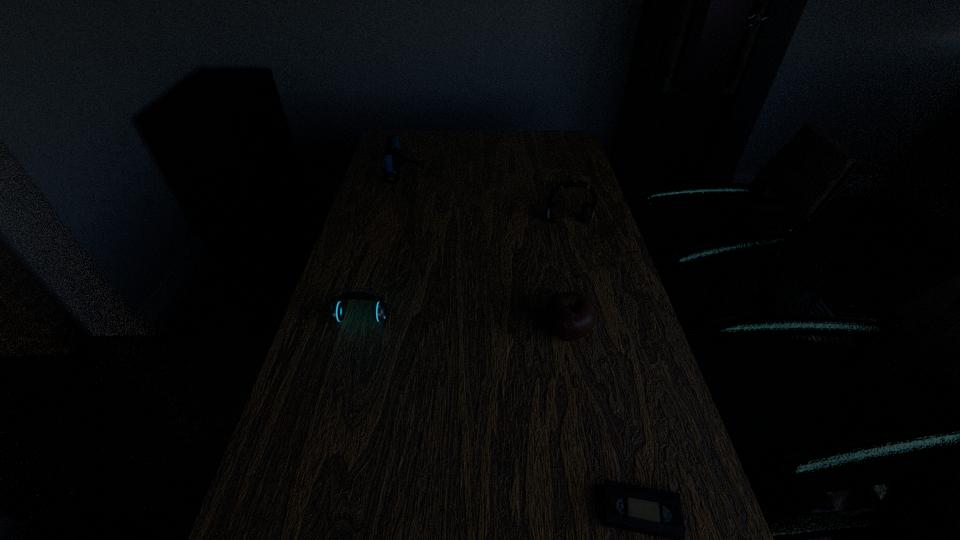
Identify the location of the farthest headset. (394, 158).

Where is `the second nearest headset`? the second nearest headset is located at coordinates (587, 212).

Find the location of a particular element. The height and width of the screenshot is (540, 960). the rightmost headset is located at coordinates (587, 212).

In order to click on apple in this screenshot , I will do `click(570, 316)`.

The width and height of the screenshot is (960, 540). Find the location of `the shortest headset`. the shortest headset is located at coordinates (337, 310).

I want to click on free point located with the microphone attached to the side of the farthest object, so click(443, 176).

You are a GUI agent. You are given a task and a screenshot of the screen. Output one action in this format:
    pyautogui.click(x=<x>, y=<y>)
    Task: Click on the free space located on the ear cup of the fourth nearest object
    
    Given the screenshot: What is the action you would take?
    pyautogui.click(x=576, y=252)

I want to click on vacant space situated 0.330m on the side of the apple with the unique marking, so click(x=403, y=332).

Locate an element on the screen. The height and width of the screenshot is (540, 960). vacant space located on the side of the apple with the unique marking is located at coordinates (496, 332).

You are a GUI agent. You are given a task and a screenshot of the screen. Output one action in this format:
    pyautogui.click(x=<x>, y=<y>)
    Task: Click on the vacant position located on the side of the apple with the unique marking
    Image resolution: width=960 pixels, height=540 pixels.
    Given the screenshot: What is the action you would take?
    pyautogui.click(x=374, y=332)